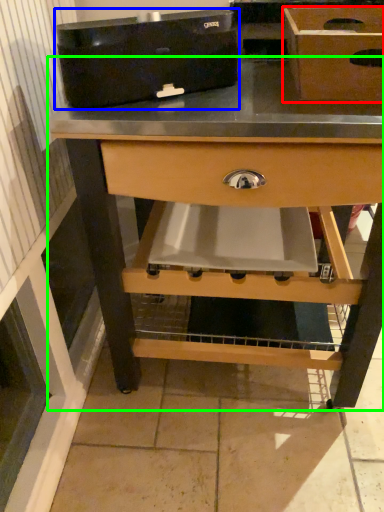
Question: Which object is the farthest from box (highlighted by a red box)? Choose among these: appliance (highlighted by a blue box) or table (highlighted by a green box).

Choices:
 (A) appliance
 (B) table

Answer: (B)